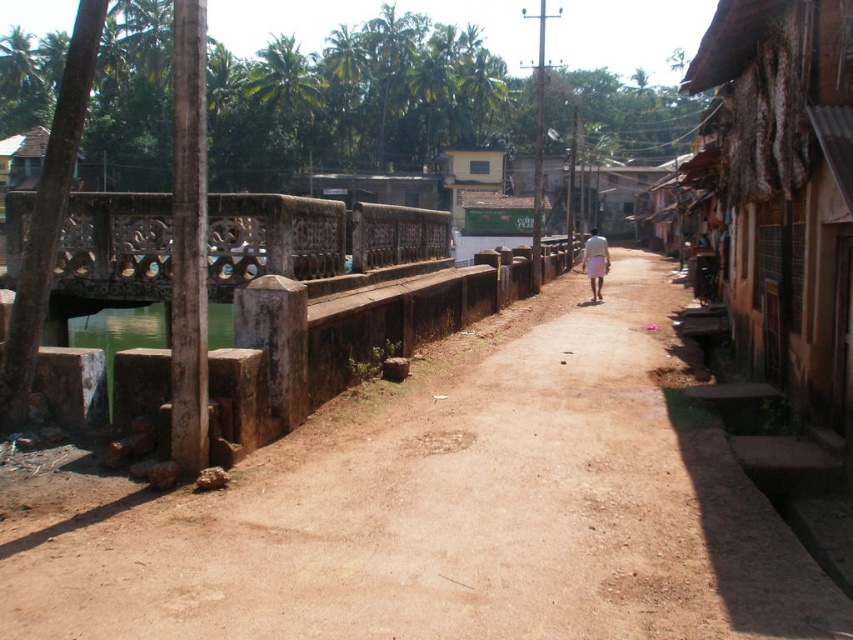
Question: Which point is farther from the camera taking this photo?

Choices:
 (A) (286, 472)
 (B) (318, 224)
 (C) (592, 272)
 (D) (817, 60)

Answer: (C)

Question: Can you confirm if brown dirt path at center is wider than white cotton pants at center?

Choices:
 (A) yes
 (B) no

Answer: (B)

Question: Is brown dirt path at center bigger than rusty corrugated tin hut at right?

Choices:
 (A) yes
 (B) no

Answer: (B)

Question: Among these points, which one is nearest to the camera?

Choices:
 (A) (759, 317)
 (B) (434, 240)

Answer: (A)

Question: Which of the following is the farthest from the observer?

Choices:
 (A) (366, 220)
 (B) (589, 237)
 (C) (421, 540)

Answer: (B)

Question: Does brown dirt path at center have a larger size compared to white cotton pants at center?

Choices:
 (A) no
 (B) yes

Answer: (A)